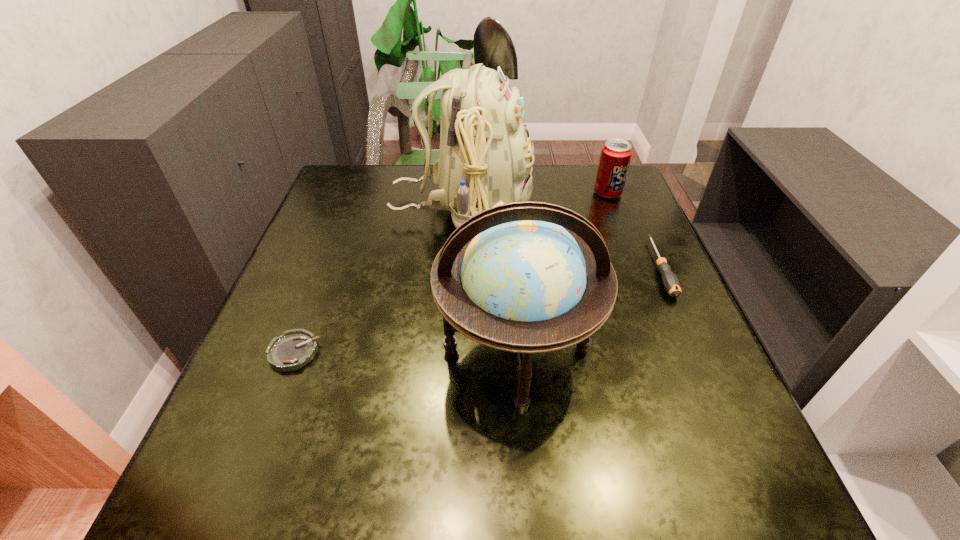
At what (x,y) coordinates should I click in order to perform the action: click on vacant region at the right edge of the desktop. Please return your answer as a coordinate pair (x, y). This screenshot has height=540, width=960. Looking at the image, I should click on (692, 326).

Where is `free region at the far right corner`? The height and width of the screenshot is (540, 960). free region at the far right corner is located at coordinates (591, 168).

This screenshot has width=960, height=540. Find the location of `free space between the ashtray and the tallest object`. free space between the ashtray and the tallest object is located at coordinates (377, 279).

Identify which object is the nearest to the screwdriver. Please provide its 2D coordinates. Your answer should be formatted as a tuple, i.e. [(x, y)], where the tuple contains the x and y coordinates of a point satisfying the conditions above.

[(616, 154)]

Locate an element on the screen. object that is the second closest to the tallest object is located at coordinates (616, 154).

At what (x,y) coordinates should I click in order to perform the action: click on free space that satisfies the following two spatial constraints: 1. on the front-facing side of the fourth tallest object; 2. on the right side of the tallest object. Please return your answer as a coordinate pair (x, y). Looking at the image, I should click on (458, 268).